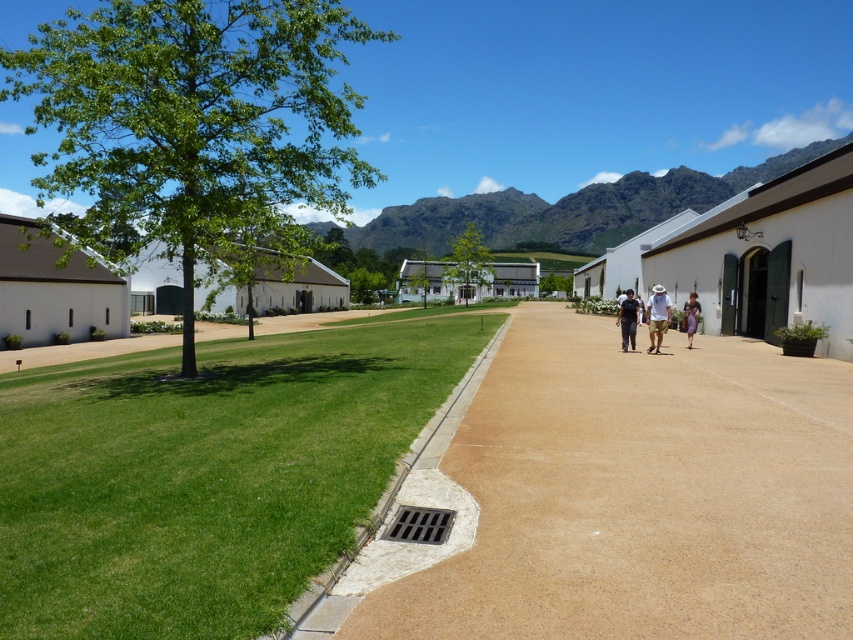
Question: Does brown concrete path at center appear over beige woven hat at center?

Choices:
 (A) no
 (B) yes

Answer: (A)

Question: Which of the following is the closest to the observer?

Choices:
 (A) tap(691, 291)
 (B) tap(660, 298)

Answer: (B)

Question: Considering the real-world distances, which object is farthest from the beige woven hat at center?

Choices:
 (A) brown concrete path at center
 (B) purple fabric bag at center-right
 (C) dark blue shirt at center

Answer: (A)

Question: Which object is closer to the camera taking this photo?

Choices:
 (A) dark blue shirt at center
 (B) beige woven hat at center
 (C) purple fabric bag at center-right
 (D) brown concrete path at center

Answer: (D)

Question: Can you confirm if green grass at lower left is positioned to the right of purple fabric bag at center-right?

Choices:
 (A) yes
 (B) no

Answer: (B)

Question: Is dark blue shirt at center thinner than purple fabric bag at center-right?

Choices:
 (A) yes
 (B) no

Answer: (B)